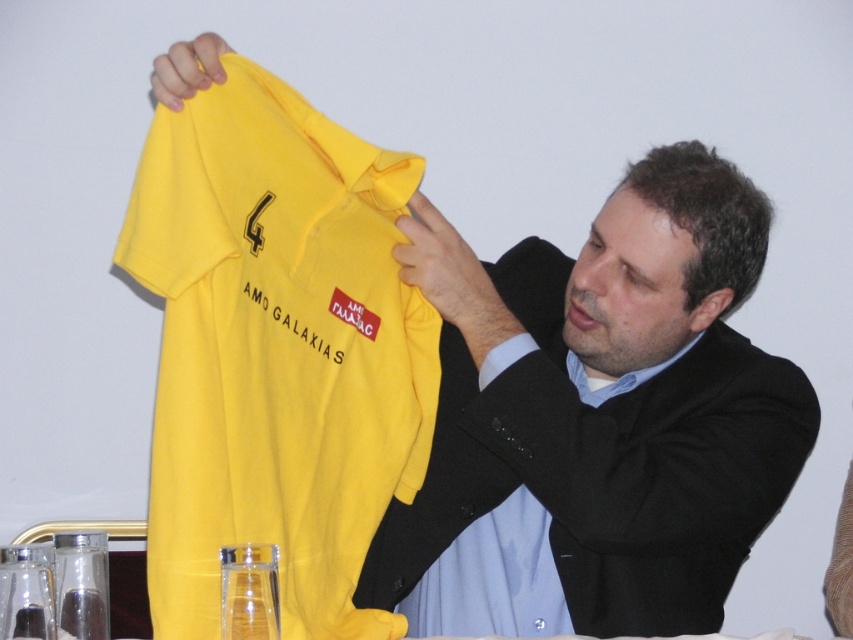
You are an event organizer at a sports venue and need to display two identical matte yellow shirts properly. The shirts are labeled as matte yellow shirt at center and matte yellow shirt at upper center. According to the image provided, how should you arrange them to match the scene?

The matte yellow shirt at center should be placed over the matte yellow shirt at upper center to replicate the arrangement shown in the scene.